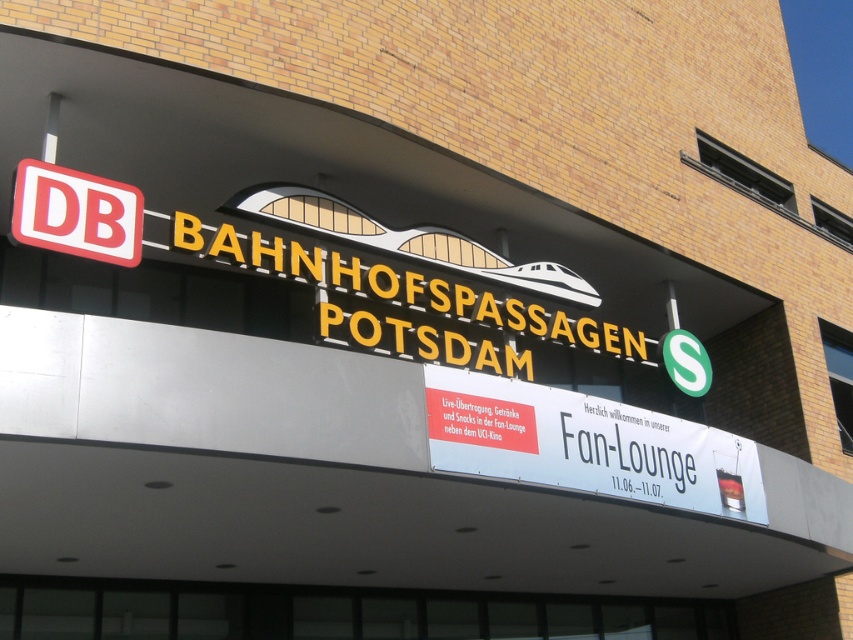
You are a tourist in Potsdam and want to find the entrance to the S Bahn. You see the white paper banner at center and the red plastic db sign at upper left. Which one is larger in size?

The white paper banner at center is bigger than the red plastic db sign at upper left.

You are a visitor at the Potsdam station and want to know if the white paper banner at center is taller than the red plastic db sign at upper left. Can you confirm this based on the scene?

The white paper banner at center is taller than the red plastic db sign at upper left according to the description.

You are a delivery person standing at the entrance of the building. You need to place a new banner that is 2 meters long between the white paper banner at center and the red plastic db sign at upper left. Is there enough space to place it without overlapping either existing banner?

The distance between the white paper banner at center and the red plastic db sign at upper left is 8.17 meters. Since the new banner is only 2 meters long, there is sufficient space to place it between them without overlapping either existing banner.